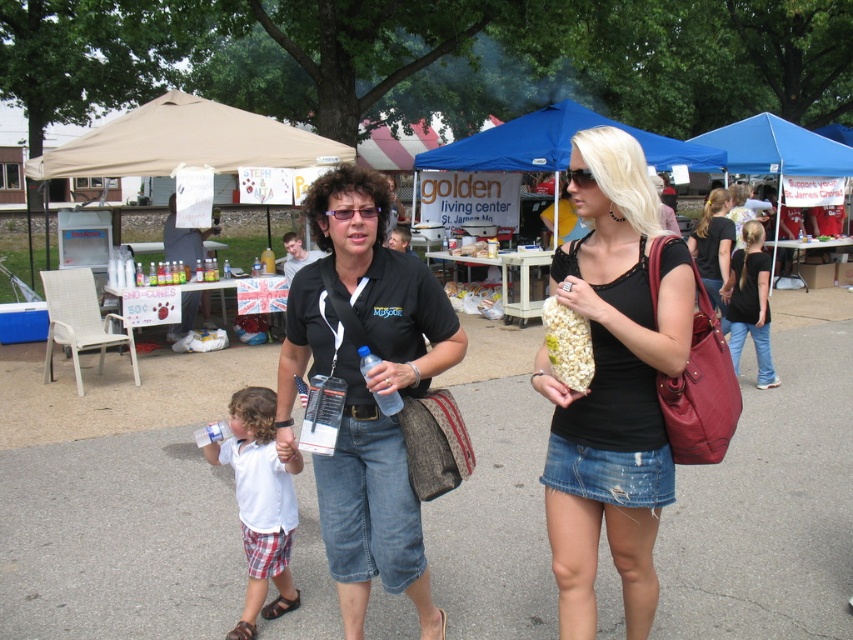
Is beige fabric tent at upper left closer to camera compared to translucent plastic water bottle at center?

No.

Is beige fabric tent at upper left smaller than translucent plastic water bottle at center?

No, beige fabric tent at upper left is not smaller than translucent plastic water bottle at center.

What do you see at coordinates (183, 141) in the screenshot?
I see `beige fabric tent at upper left` at bounding box center [183, 141].

Locate an element on the screen. The image size is (853, 640). beige fabric tent at upper left is located at coordinates (183, 141).

Who is more forward, [724,324] or [178,243]?

Point [724,324] is more forward.

Does point (712, 280) lie in front of point (173, 193)?

Yes, it is in front of point (173, 193).

Between point (714, 266) and point (184, 237), which one is positioned in front?

Positioned in front is point (714, 266).

Image resolution: width=853 pixels, height=640 pixels. Find the location of `black leather purse at center`. black leather purse at center is located at coordinates (712, 248).

Image resolution: width=853 pixels, height=640 pixels. I want to click on beige fabric tent at upper left, so click(183, 141).

Between beige fabric tent at upper left and blue fabric tent at upper right, which one is positioned higher?

blue fabric tent at upper right is above.

Image resolution: width=853 pixels, height=640 pixels. What do you see at coordinates (183, 141) in the screenshot?
I see `beige fabric tent at upper left` at bounding box center [183, 141].

You are a GUI agent. You are given a task and a screenshot of the screen. Output one action in this format:
    pyautogui.click(x=<x>, y=<y>)
    Task: Click on the beige fabric tent at upper left
    The width and height of the screenshot is (853, 640).
    Given the screenshot: What is the action you would take?
    pyautogui.click(x=183, y=141)